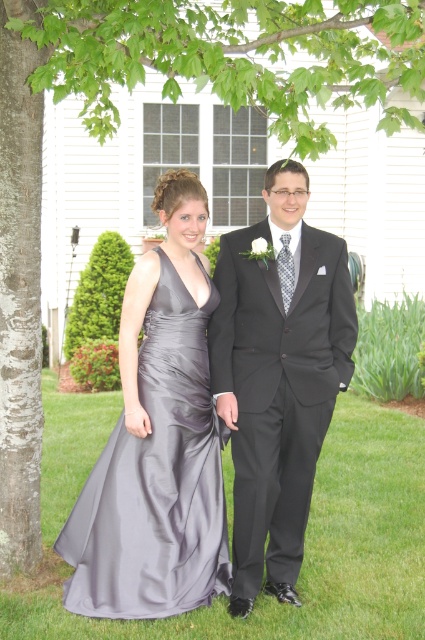
Question: Does silky gray dress at center lie behind satin dress at left?

Choices:
 (A) yes
 (B) no

Answer: (B)

Question: In this image, where is shiny black suit at center located relative to satin dress at left?

Choices:
 (A) above
 (B) below

Answer: (A)

Question: Which object is farther from the camera taking this photo?

Choices:
 (A) silky gray dress at center
 (B) satin dress at left
 (C) satin dress at center

Answer: (B)

Question: Which point appears farthest from the camera in this image?

Choices:
 (A) (292, 300)
 (B) (274, 232)
 (C) (198, 314)

Answer: (C)

Question: Which point is farther to the camera?

Choices:
 (A) satin dress at center
 (B) silky gray dress at center
 (C) shiny black suit at center
 (D) satin dress at left

Answer: (C)

Question: Observing the image, what is the correct spatial positioning of silky gray dress at center in reference to satin dress at left?

Choices:
 (A) right
 (B) left

Answer: (A)